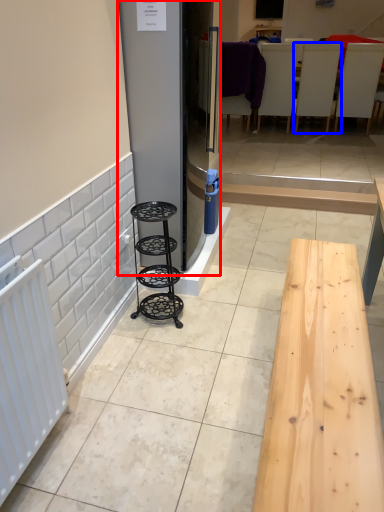
Question: Which object is closer to the camera taking this photo, fridge (highlighted by a red box) or furniture (highlighted by a blue box)?

Choices:
 (A) fridge
 (B) furniture

Answer: (A)